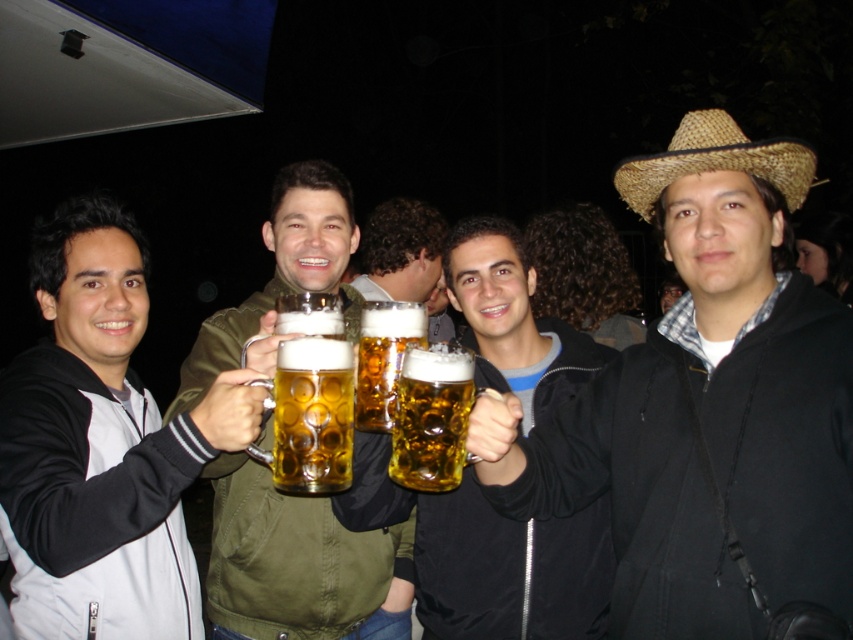
Question: Is matte straw hat at center bigger than matte black jacket at center?

Choices:
 (A) no
 (B) yes

Answer: (B)

Question: Which object is closer to the camera taking this photo?

Choices:
 (A) golden glass mug at center
 (B) shiny gold mug at center
 (C) matte straw hat at center

Answer: (C)

Question: Which point appears closest to the camera in this image?

Choices:
 (A) (368, 634)
 (B) (389, 360)
 (C) (457, 396)
 (D) (428, 547)

Answer: (C)

Question: Is matte straw hat at center to the left of shiny brass mug at center from the viewer's perspective?

Choices:
 (A) yes
 (B) no

Answer: (B)

Question: Which point is farther to the camera?

Choices:
 (A) (653, 189)
 (B) (521, 563)
 (C) (337, 534)
 (D) (387, 342)

Answer: (C)

Question: Does matte black jacket at center have a larger size compared to shiny gold mug at center?

Choices:
 (A) yes
 (B) no

Answer: (A)